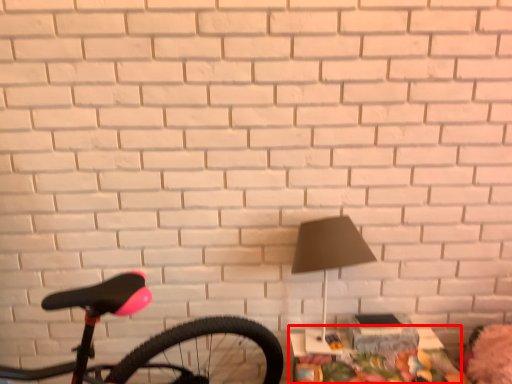
Question: From the image's perspective, what is the correct spatial relationship of table (annotated by the red box) in relation to lamp?

Choices:
 (A) above
 (B) below

Answer: (B)